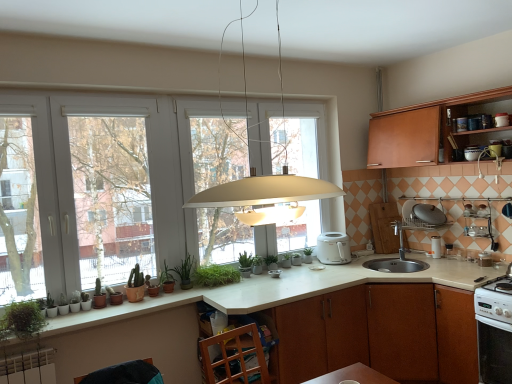
What do you see at coordinates (185, 271) in the screenshot? I see `green matte plant at lower left, which ranks as the 2th plant in back-to-front order` at bounding box center [185, 271].

I want to click on green matte plant at lower left, which ranks as the 2th plant in back-to-front order, so click(x=185, y=271).

Describe the element at coordinates (263, 193) in the screenshot. Image resolution: width=512 pixels, height=384 pixels. I see `matte white pendant light at center` at that location.

Measure the distance between point (415, 209) and camera.

Point (415, 209) is 11.93 feet from camera.

How much space does green matte plant at lower left, which appears as the first plant when viewed from the left, occupy vertically?

green matte plant at lower left, which appears as the first plant when viewed from the left, is 8.87 inches tall.

Measure the distance between matte brown pot at lower left, the second plant in the left-to-right sequence, and camera.

matte brown pot at lower left, the second plant in the left-to-right sequence, and camera are 8.81 feet apart from each other.

What do you see at coordinates (275, 273) in the screenshot? Image resolution: width=512 pixels, height=384 pixels. I see `white plastic toaster at center, the first appliance in the left-to-right sequence` at bounding box center [275, 273].

Image resolution: width=512 pixels, height=384 pixels. Find the location of `white glossy window at upper center`. white glossy window at upper center is located at coordinates (159, 180).

Who is bigger, brown wood cabinet at lower center, marked as the first cabinetry in a bottom-to-top arrangement, or white plastic toaster at upper right, which appears as the 2th kitchen appliance when ordered from the bottom?

brown wood cabinet at lower center, marked as the first cabinetry in a bottom-to-top arrangement, is bigger.

Is brown wood cabinet at lower center, which ranks as the second cabinetry in top-to-bottom order, facing away from white plastic toaster at upper right, which ranks as the 1th kitchen appliance in top-to-bottom order?

No, brown wood cabinet at lower center, which ranks as the second cabinetry in top-to-bottom order, is not facing away from white plastic toaster at upper right, which ranks as the 1th kitchen appliance in top-to-bottom order.

In terms of width, does brown wood cabinet at lower center, marked as the first cabinetry in a bottom-to-top arrangement, look wider or thinner when compared to white plastic toaster at upper right, placed as the second kitchen appliance when sorted from right to left?

Clearly, brown wood cabinet at lower center, marked as the first cabinetry in a bottom-to-top arrangement, has more width compared to white plastic toaster at upper right, placed as the second kitchen appliance when sorted from right to left.

From the image's perspective, is brown wood cabinet at lower center, which ranks as the second cabinetry in top-to-bottom order, located above or below white plastic toaster at upper right, which is counted as the first kitchen appliance, starting from the left?

Based on their image positions, brown wood cabinet at lower center, which ranks as the second cabinetry in top-to-bottom order, is located beneath white plastic toaster at upper right, which is counted as the first kitchen appliance, starting from the left.

From the image's perspective, who appears lower, matte white pendant light at center or white plastic toaster at center, placed as the 3th appliance when sorted from front to back?

white plastic toaster at center, placed as the 3th appliance when sorted from front to back, from the image's perspective.

How different are the orientations of matte white pendant light at center and white plastic toaster at center, the 4th appliance positioned from the right, in degrees?

0.000181 degrees.

Does matte white pendant light at center have a greater height compared to white plastic toaster at center, arranged as the fourth appliance when viewed from the top?

Yes.

Is white plastic toaster at center, acting as the second appliance starting from the back, a part of matte white pendant light at center?

That's incorrect, white plastic toaster at center, acting as the second appliance starting from the back, is not inside matte white pendant light at center.

Is wooden cabinet at upper right, marked as the first cabinetry in a top-to-bottom arrangement, directly adjacent to green matte cactus at lower left, the third plant positioned from the front?

wooden cabinet at upper right, marked as the first cabinetry in a top-to-bottom arrangement, and green matte cactus at lower left, the third plant positioned from the front, are not in contact.

Identify the location of the 4th plant to the left of the wooden cabinet at upper right, marked as the first cabinetry in a top-to-bottom arrangement, counting from the anchor's position. This screenshot has height=384, width=512. (99, 296).

Looking at their sizes, would you say wooden cabinet at upper right, the second cabinetry in the bottom-to-top sequence, is wider or thinner than green matte cactus at lower left, marked as the third plant in a left-to-right arrangement?

Considering their sizes, wooden cabinet at upper right, the second cabinetry in the bottom-to-top sequence, looks broader than green matte cactus at lower left, marked as the third plant in a left-to-right arrangement.

Is green matte plant at center, which is the fourth plant in front-to-back order, at the right side of white plastic toaster at center, the first appliance in the left-to-right sequence?

Incorrect, green matte plant at center, which is the fourth plant in front-to-back order, is not on the right side of white plastic toaster at center, the first appliance in the left-to-right sequence.

Is green matte plant at center, the 3th plant positioned from the back, oriented towards white plastic toaster at center, the first appliance in the left-to-right sequence?

No, green matte plant at center, the 3th plant positioned from the back, is not facing towards white plastic toaster at center, the first appliance in the left-to-right sequence.

Does point (219, 265) lie in front of point (268, 272)?

Yes, it is in front of point (268, 272).

Which object is closer to the camera taking this photo, green matte plant at center, which is the fourth plant in front-to-back order, or white plastic toaster at center, acting as the second appliance starting from the back?

green matte plant at center, which is the fourth plant in front-to-back order.

Considering the relative positions of matte brown pot at lower left, the second plant in the left-to-right sequence, and matte white pendant light at center in the image provided, is matte brown pot at lower left, the second plant in the left-to-right sequence, behind matte white pendant light at center?

Yes, the depth of matte brown pot at lower left, the second plant in the left-to-right sequence, is greater than that of matte white pendant light at center.

Considering the relative sizes of matte brown pot at lower left, placed as the second plant when sorted from front to back, and matte white pendant light at center in the image provided, is matte brown pot at lower left, placed as the second plant when sorted from front to back, smaller than matte white pendant light at center?

Yes, matte brown pot at lower left, placed as the second plant when sorted from front to back, is smaller than matte white pendant light at center.

Considering the relative positions of matte brown pot at lower left, placed as the second plant when sorted from front to back, and matte white pendant light at center in the image provided, is matte brown pot at lower left, placed as the second plant when sorted from front to back, to the left or to the right of matte white pendant light at center?

In the image, matte brown pot at lower left, placed as the second plant when sorted from front to back, appears on the left side of matte white pendant light at center.

From a real-world perspective, is matte brown pot at lower left, which is counted as the fifth plant, starting from the back, above or below matte white pendant light at center?

Clearly, from a real-world perspective, matte brown pot at lower left, which is counted as the fifth plant, starting from the back, is below matte white pendant light at center.

Find the location of a particular element. Image resolution: width=512 pixels, height=384 pixels. gas stove in front of the satin nickel sink at lower right is located at coordinates (495, 300).

Is satin nickel sink at lower right in front of white glossy gas stove at lower right?

No, it is not.

Is satin nickel sink at lower right outside of white glossy gas stove at lower right?

Yes, satin nickel sink at lower right is located beyond the bounds of white glossy gas stove at lower right.

From a real-world perspective, is satin nickel sink at lower right beneath white glossy gas stove at lower right?

No, from a real-world perspective, satin nickel sink at lower right is not below white glossy gas stove at lower right.

Is wooden cabinet at upper right, the second cabinetry in the bottom-to-top sequence, completely or partially inside matte white toaster at upper right, which is the 4th appliance from bottom to top?

Definitely not — wooden cabinet at upper right, the second cabinetry in the bottom-to-top sequence, is not inside matte white toaster at upper right, which is the 4th appliance from bottom to top.

Are matte white toaster at upper right, which is counted as the 1th appliance, starting from the front, and wooden cabinet at upper right, marked as the first cabinetry in a top-to-bottom arrangement, making contact?

No, matte white toaster at upper right, which is counted as the 1th appliance, starting from the front, is not next to wooden cabinet at upper right, marked as the first cabinetry in a top-to-bottom arrangement.

Which is in front, point (503, 116) or point (425, 139)?

Positioned in front is point (503, 116).

From the image's perspective, which object appears higher, matte white toaster at upper right, marked as the fourth appliance in a back-to-front arrangement, or wooden cabinet at upper right, marked as the first cabinetry in a top-to-bottom arrangement?

matte white toaster at upper right, marked as the fourth appliance in a back-to-front arrangement, appears higher in the image.

You are a GUI agent. You are given a task and a screenshot of the screen. Output one action in this format:
    pyautogui.click(x=<x>, y=<y>)
    Task: Click on the cabinetry below the white plastic toaster at upper right, which ranks as the 1th kitchen appliance in top-to-bottom order (from the image's perspective)
    
    Given the screenshot: What is the action you would take?
    pyautogui.click(x=381, y=333)

Where is `lamp on the left of white plastic toaster at center, placed as the 3th appliance when sorted from front to back`? lamp on the left of white plastic toaster at center, placed as the 3th appliance when sorted from front to back is located at coordinates (263, 193).

Estimate the real-world distances between objects in this image. Which object is further from metallic silver toaster at upper right, the third appliance when ordered from left to right, satin nickel sink at lower right or wooden cabinet at upper right, the second cabinetry in the bottom-to-top sequence?

Based on the image, satin nickel sink at lower right appears to be further to metallic silver toaster at upper right, the third appliance when ordered from left to right.

Which object lies nearer to the anchor point matte white pendant light at center, matte white toaster at upper right, marked as the 4th appliance in a left-to-right arrangement, or green matte plant at lower left, which is counted as the sixth plant, starting from the right?

Based on the image, green matte plant at lower left, which is counted as the sixth plant, starting from the right, appears to be nearer to matte white pendant light at center.

Considering their positions, is white plastic toaster at upper right, positioned as the 1th kitchen appliance in back-to-front order, positioned closer to matte brown pot at lower left, the second plant in the left-to-right sequence, than metallic silver toaster at upper right, the third appliance when ordered from left to right?

white plastic toaster at upper right, positioned as the 1th kitchen appliance in back-to-front order, lies closer to matte brown pot at lower left, the second plant in the left-to-right sequence, than the other object.

Based on their spatial positions, is white plastic toaster at center, acting as the second appliance starting from the back, or green matte plant at center, which ranks as the sixth plant in left-to-right order, further from metallic silver toaster at upper right, marked as the third appliance in a back-to-front arrangement?

green matte plant at center, which ranks as the sixth plant in left-to-right order, is positioned further to the anchor metallic silver toaster at upper right, marked as the third appliance in a back-to-front arrangement.

Looking at the image, which one is located further to matte white pendant light at center, satin nickel sink at lower right or white plastic toaster at upper right, positioned as the 1th kitchen appliance in back-to-front order?

white plastic toaster at upper right, positioned as the 1th kitchen appliance in back-to-front order, lies further to matte white pendant light at center than the other object.

Looking at the image, which one is located closer to green matte plant at center, acting as the 1th plant starting from the back, brown wood cabinet at lower center, which ranks as the second cabinetry in top-to-bottom order, or wooden cabinet at upper right, the second cabinetry in the bottom-to-top sequence?

A: brown wood cabinet at lower center, which ranks as the second cabinetry in top-to-bottom order, is positioned closer to the anchor green matte plant at center, acting as the 1th plant starting from the back.

When comparing their distances from satin nickel sink at lower right, does green matte plant at center, acting as the 1th plant starting from the back, or green matte cactus at lower left, the 4th plant from the back, seem closer?

Based on the image, green matte plant at center, acting as the 1th plant starting from the back, appears to be nearer to satin nickel sink at lower right.

Consider the image. From the image, which object appears to be nearer to matte white pendant light at center, green matte plant at center, which ranks as the sixth plant in left-to-right order, or white glossy gas stove at lower right?

→ Among the two, white glossy gas stove at lower right is located nearer to matte white pendant light at center.

Identify the location of kitchen appliance located between green matte plant at center, placed as the 2th plant when sorted from right to left, and wooden cabinet at upper right, the second cabinetry in the bottom-to-top sequence, in the left-right direction. (333, 248).

The width and height of the screenshot is (512, 384). I want to click on countertop positioned between matte white pendant light at center and wooden cabinet at upper right, marked as the first cabinetry in a top-to-bottom arrangement, from near to far, so click(x=225, y=312).

Locate an element on the screen. window between green matte cactus at lower left, the 4th plant from the back, and brown wood cabinet at lower center, which ranks as the second cabinetry in top-to-bottom order is located at coordinates (159, 180).

Where is `countertop between matte white pendant light at center and green matte plant at lower left, acting as the 5th plant starting from the front, from front to back`? countertop between matte white pendant light at center and green matte plant at lower left, acting as the 5th plant starting from the front, from front to back is located at coordinates [x=225, y=312].